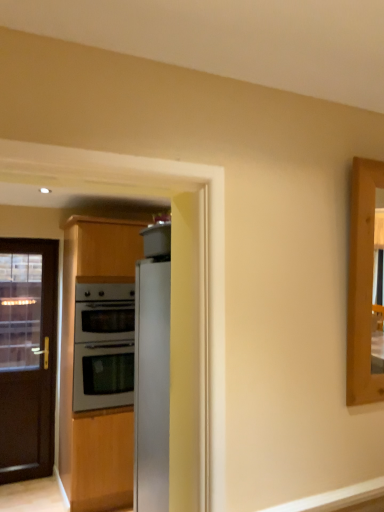
Question: In terms of width, does black glass door at left look wider or thinner when compared to sleek metallic refrigerator at center?

Choices:
 (A) thin
 (B) wide

Answer: (A)

Question: Considering their positions, is black glass door at left located in front of or behind sleek metallic refrigerator at center?

Choices:
 (A) behind
 (B) front

Answer: (A)

Question: Considering the real-world distances, which object is closest to the satin silver oven at center?

Choices:
 (A) black glass door at left
 (B) sleek metallic refrigerator at center

Answer: (A)

Question: Which is nearer to the satin silver oven at center?

Choices:
 (A) sleek metallic refrigerator at center
 (B) black glass door at left

Answer: (B)